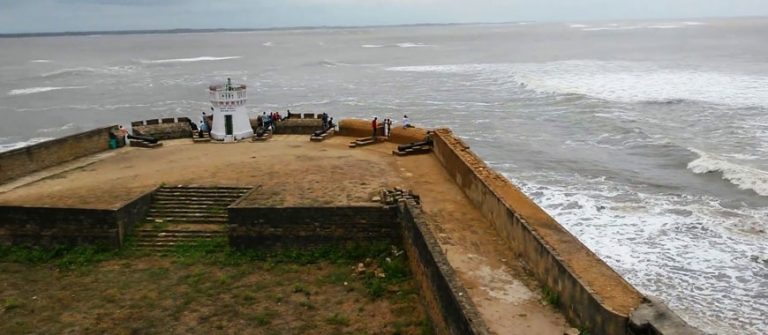
Locate an element on the screen. This screenshot has width=768, height=335. stairs is located at coordinates (187, 195).